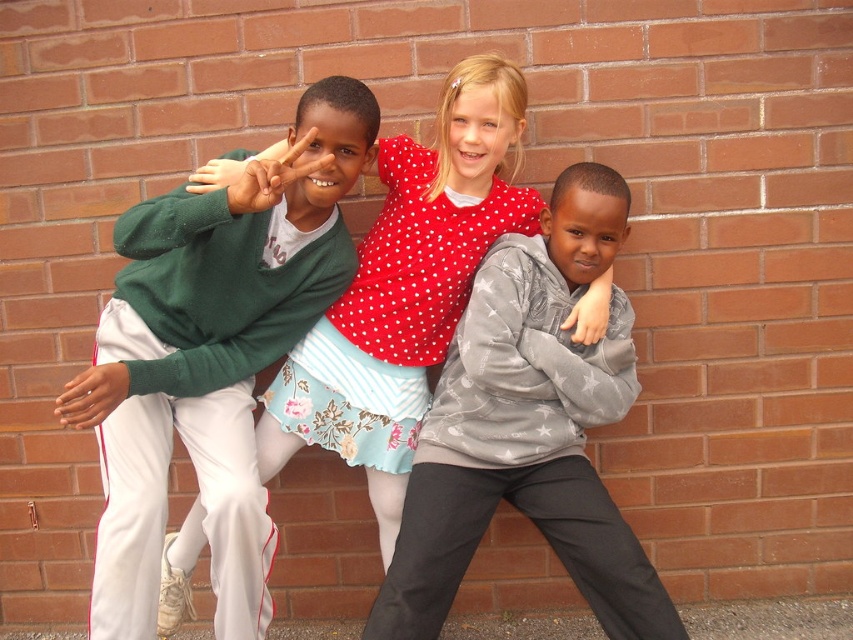
Between green sweater at left and polka dot fabric dress at center, which one is positioned higher?

green sweater at left is higher up.

Which is more to the left, green sweater at left or polka dot fabric dress at center?

From the viewer's perspective, green sweater at left appears more on the left side.

Where is `green sweater at left`? The width and height of the screenshot is (853, 640). green sweater at left is located at coordinates (212, 356).

Who is positioned more to the left, green sweater at left or gray velvety sweatshirt at center?

From the viewer's perspective, green sweater at left appears more on the left side.

Is point (123, 486) behind point (595, 230)?

No, (123, 486) is in front of (595, 230).

Is point (187, 342) in front of point (616, 368)?

That is True.

The image size is (853, 640). I want to click on green sweater at left, so click(212, 356).

Does gray velvety sweatshirt at center have a lesser width compared to polka dot fabric dress at center?

Correct, gray velvety sweatshirt at center's width is less than polka dot fabric dress at center's.

Between gray velvety sweatshirt at center and polka dot fabric dress at center, which one has less height?

gray velvety sweatshirt at center is shorter.

Does point (556, 228) come closer to viewer compared to point (402, 349)?

Yes, it is.

Image resolution: width=853 pixels, height=640 pixels. I want to click on gray velvety sweatshirt at center, so click(x=527, y=429).